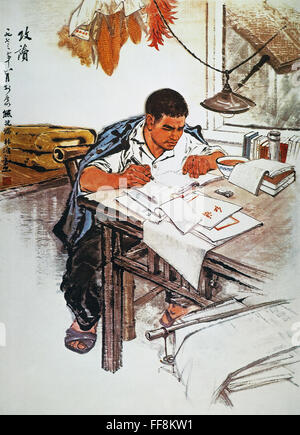
You are a GUI agent. You are given a task and a screenshot of the screen. Output one action in this format:
    pyautogui.click(x=<x>, y=<y>)
    Task: Click on the lightbulb
    
    Given the screenshot: What is the action you would take?
    tap(226, 115)